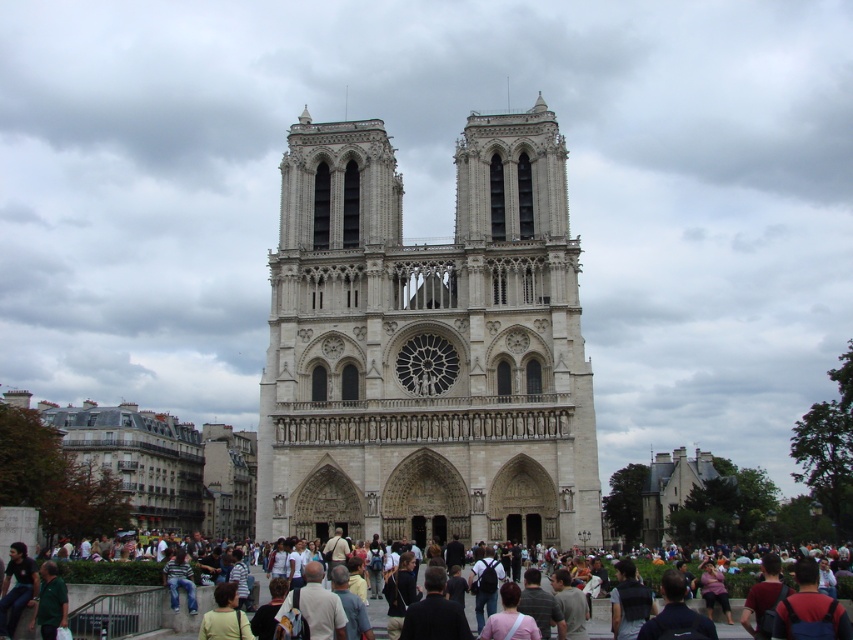
Question: Is white stone cathedral at center closer to camera compared to dark gray clothing at center?

Choices:
 (A) yes
 (B) no

Answer: (B)

Question: Does white stone cathedral at center have a greater width compared to dark gray clothing at center?

Choices:
 (A) no
 (B) yes

Answer: (A)

Question: Among these points, which one is nearest to the camera?

Choices:
 (A) (515, 156)
 (B) (698, 602)

Answer: (B)

Question: Can you confirm if white stone cathedral at center is positioned below dark gray clothing at center?

Choices:
 (A) no
 (B) yes

Answer: (A)